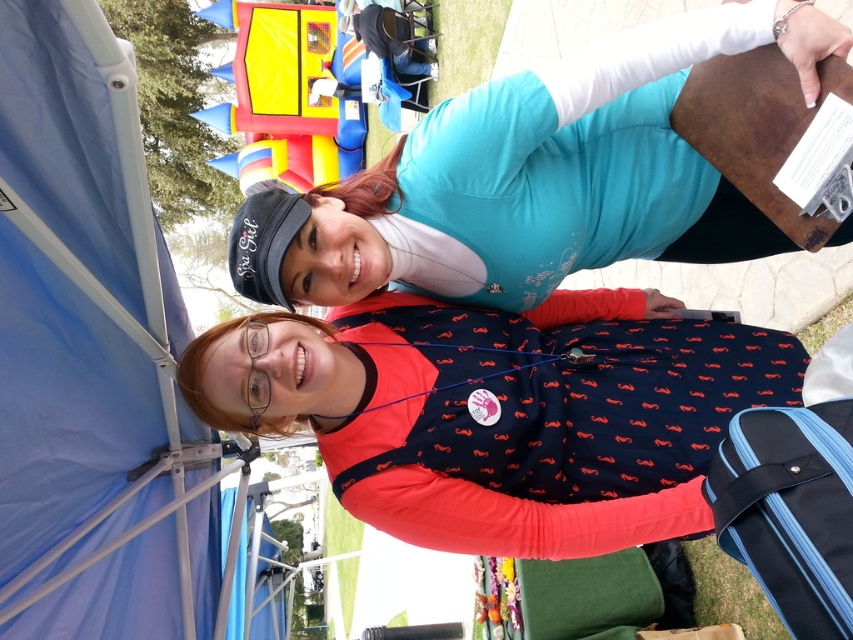
You are organizing a community event and need to place a sign on a table. The table has limited space. You have the navy blue fabric with orange mustache pattern at center and the blue fabric suitcase at lower right. Which object should you choose to place on the table to maximize visibility without blocking the view?

The navy blue fabric with orange mustache pattern at center is much taller than the blue fabric suitcase at lower right, so placing it on the table would maximize visibility without blocking the view as it stands out more due to its height.

You are planning to hang a blue fabric canopy at upper left and a blue fabric suitcase at lower right in your backyard. Considering their heights, which one will require a higher hanging point?

The blue fabric canopy at upper left requires a higher hanging point because it has a greater height compared to the blue fabric suitcase at lower right.

Based on the coordinates provided, which object is located at the point with the coordinates (x=90, y=353)?

The blue fabric canopy at upper left is located at the point with the coordinates (x=90, y=353).